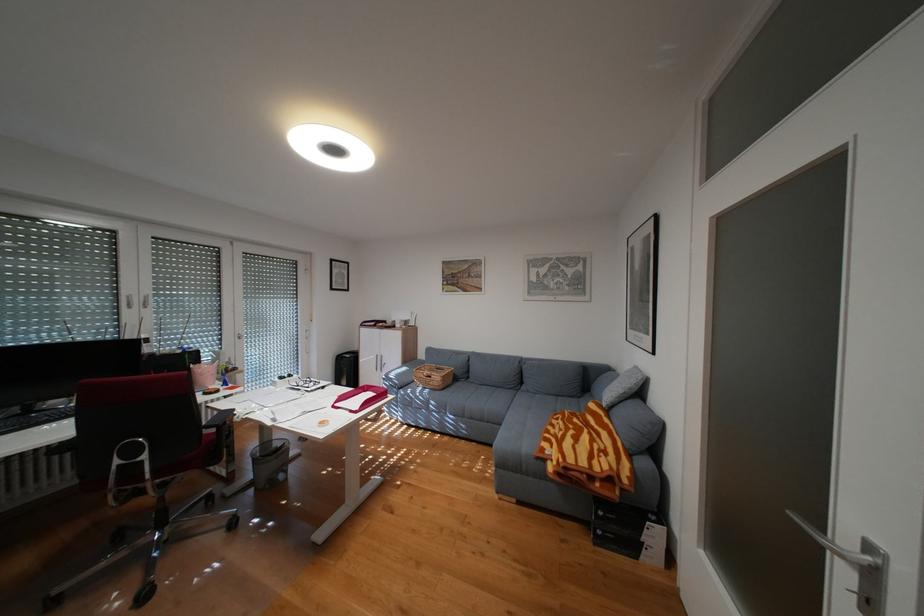
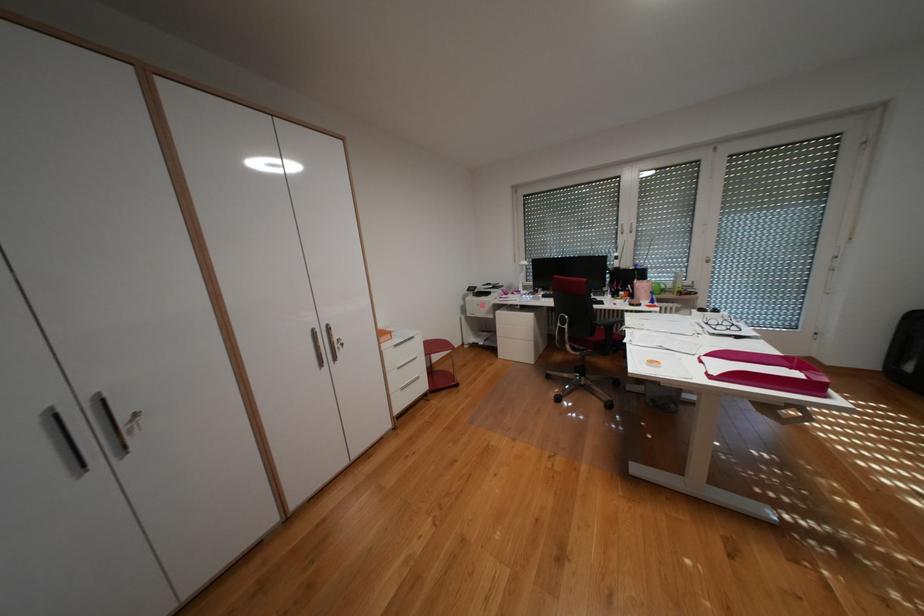
Question: The camera is either moving clockwise (left) or counter-clockwise (right) around the object. The first image is from the beginning of the video and the second image is from the end. Is the camera moving left or right when shooting the video?

Choices:
 (A) Left
 (B) Right

Answer: (B)